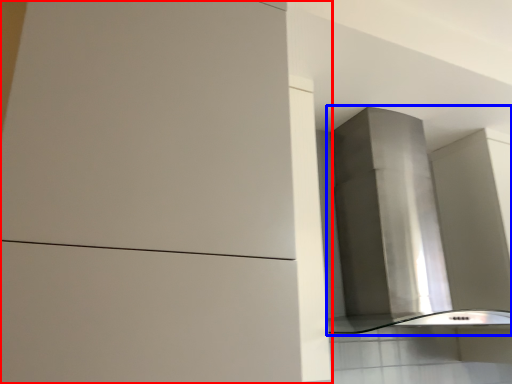
Question: Which point is closer to the camera, cabinetry (highlighted by a red box) or vent (highlighted by a blue box)?

Choices:
 (A) cabinetry
 (B) vent

Answer: (A)